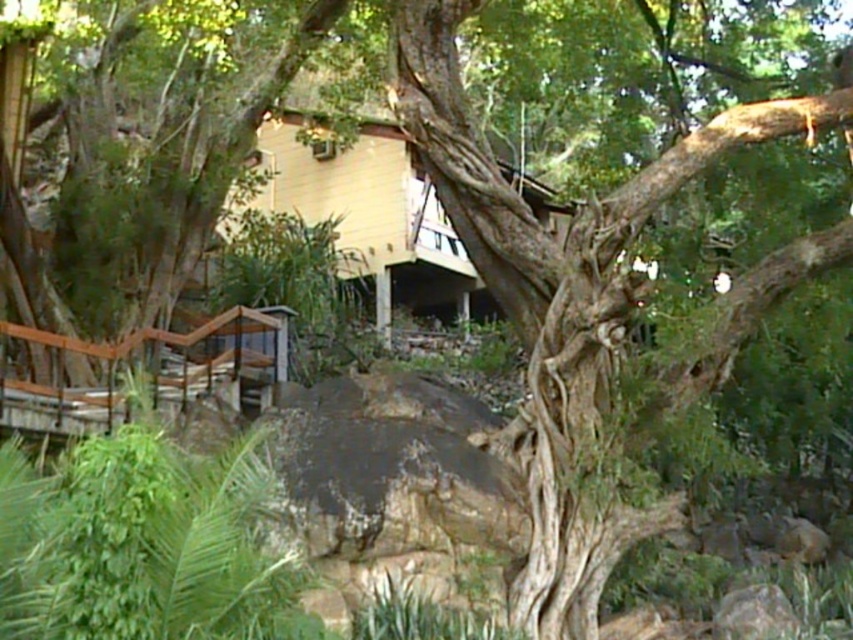
Which is in front, point (740, 627) or point (785, 524)?

Point (740, 627) is more forward.

Does point (746, 618) come farther from viewer compared to point (775, 545)?

No.

Locate an element on the screen. The image size is (853, 640). gray rough stone at lower right is located at coordinates (753, 612).